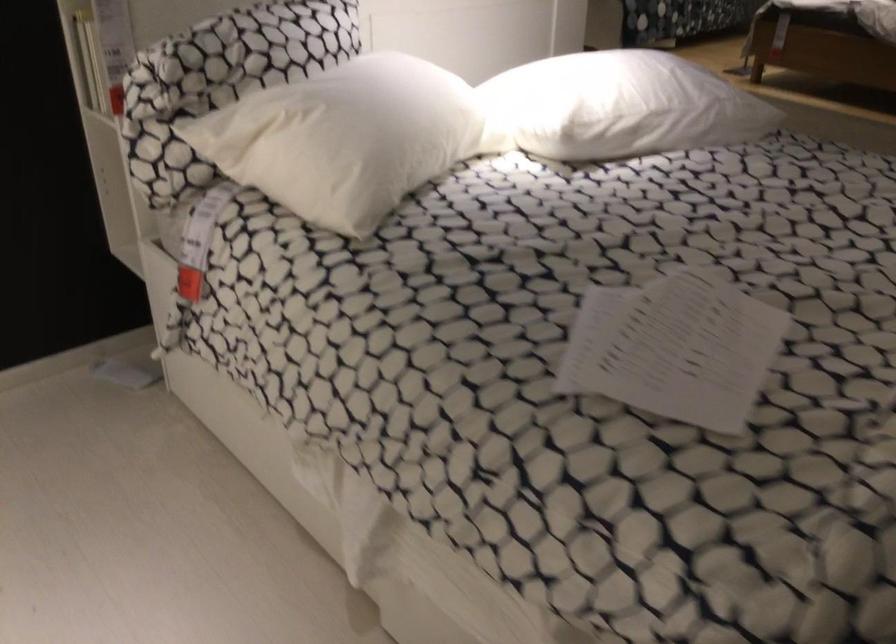
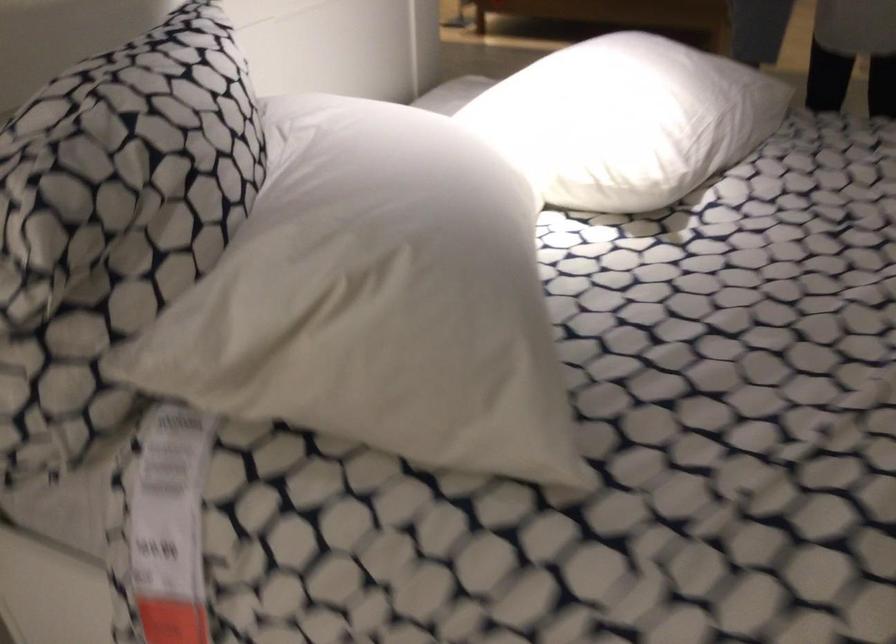
Find the pixel in the second image that matches (220,69) in the first image.

(116, 205)